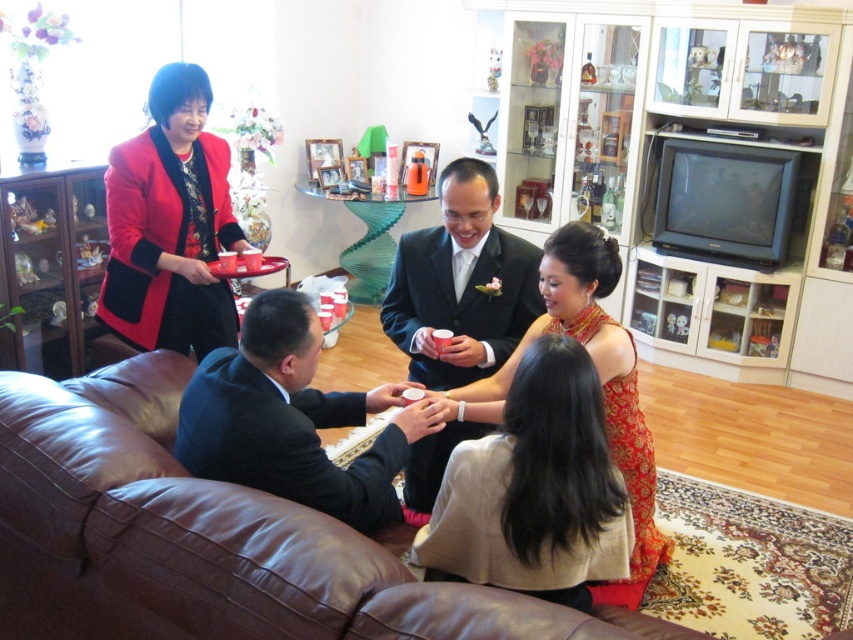
Question: Which object is closer to the camera taking this photo?

Choices:
 (A) shiny black suit at center
 (B) brown leather couch at lower left
 (C) dark blue suit at center
 (D) silk red dress at center

Answer: (B)

Question: Is brown leather couch at lower left thinner than matte red blazer at left?

Choices:
 (A) yes
 (B) no

Answer: (B)

Question: Which point appears farthest from the camera in this image?

Choices:
 (A) (480, 396)
 (B) (148, 150)

Answer: (B)

Question: Which point is farther from the camera taking this photo?

Choices:
 (A) (428, 305)
 (B) (166, 243)
 (C) (209, 456)
 (D) (590, 236)

Answer: (B)

Question: Can you confirm if brown leather couch at lower left is smaller than shiny black suit at center?

Choices:
 (A) no
 (B) yes

Answer: (A)

Question: Is matte red blazer at left smaller than silk red dress at center?

Choices:
 (A) no
 (B) yes

Answer: (B)